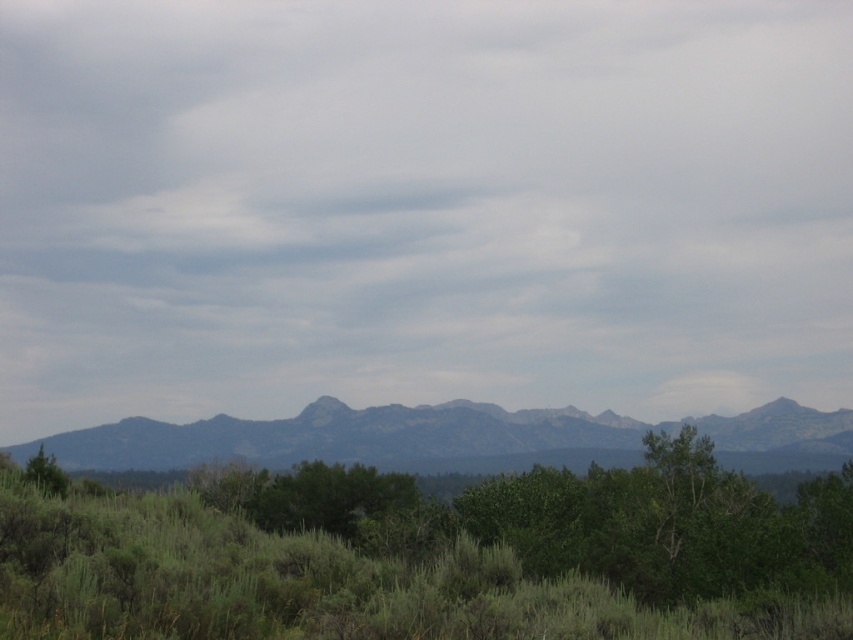
Who is more forward, (288, 474) or (734, 420)?

Positioned in front is point (288, 474).

The width and height of the screenshot is (853, 640). In order to click on green leafy tree at center in this screenshot , I will do `click(433, 556)`.

Between gray matte cloud at upper center and gray rocky mountains at center, which one is positioned higher?

gray matte cloud at upper center is higher up.

You are a GUI agent. You are given a task and a screenshot of the screen. Output one action in this format:
    pyautogui.click(x=<x>, y=<y>)
    Task: Click on the gray matte cloud at upper center
    Image resolution: width=853 pixels, height=640 pixels.
    Given the screenshot: What is the action you would take?
    pyautogui.click(x=422, y=205)

Locate an element on the screen. Image resolution: width=853 pixels, height=640 pixels. gray matte cloud at upper center is located at coordinates (422, 205).

Locate an element on the screen. gray matte cloud at upper center is located at coordinates (422, 205).

You are a GUI agent. You are given a task and a screenshot of the screen. Output one action in this format:
    pyautogui.click(x=<x>, y=<y>)
    Task: Click on the gray matte cloud at upper center
    Image resolution: width=853 pixels, height=640 pixels.
    Given the screenshot: What is the action you would take?
    pyautogui.click(x=422, y=205)